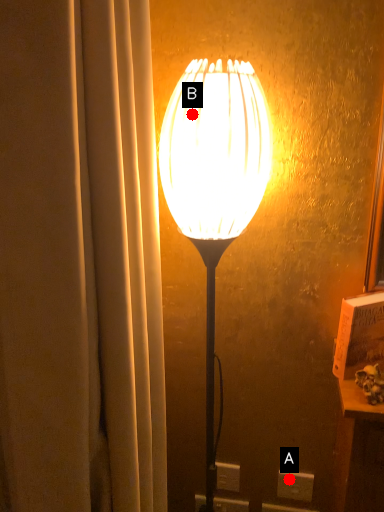
Question: Two points are circled on the image, labeled by A and B beside each circle. Among these points, which one is farthest from the camera?

Choices:
 (A) A is further
 (B) B is further

Answer: (A)